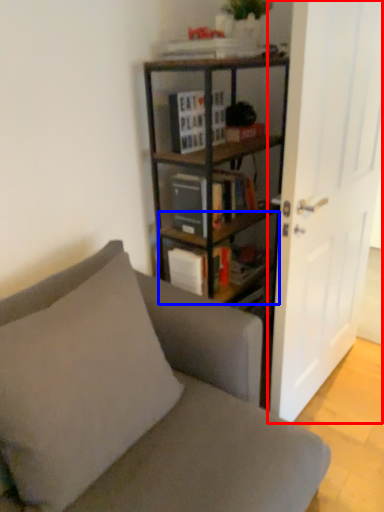
Question: Which point is closer to the camera, door (highlighted by a red box) or shelf (highlighted by a blue box)?

Choices:
 (A) door
 (B) shelf

Answer: (A)